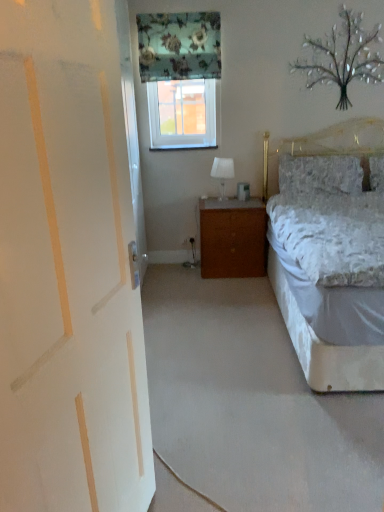
What do you see at coordinates (179, 46) in the screenshot? I see `floral fabric curtain at upper center` at bounding box center [179, 46].

Describe the element at coordinates (232, 238) in the screenshot. The height and width of the screenshot is (512, 384). I see `brown wood nightstand at center` at that location.

In order to face white glossy table lamp at center, should I rotate leftwards or rightwards?

It's best to rotate right around 3.916 degrees.

Describe the element at coordinates (343, 57) in the screenshot. I see `metallic silver tree at upper right` at that location.

The image size is (384, 512). Describe the element at coordinates (182, 114) in the screenshot. I see `clear glass window at upper center` at that location.

In order to face fluffy white pillow at right, should I rotate leftwards or rightwards?

A 16.675 degree turn to the right will do.

What do you see at coordinates (320, 174) in the screenshot? The width and height of the screenshot is (384, 512). I see `fluffy white pillow at right` at bounding box center [320, 174].

Identify the location of white painted wood door at left. (68, 268).

In order to click on floral fabric curtain at upper center in this screenshot , I will do `click(179, 46)`.

Is clear glass window at upper center oriented towards white glossy table lamp at center?

No, clear glass window at upper center does not turn towards white glossy table lamp at center.

Considering the relative sizes of clear glass window at upper center and white glossy table lamp at center in the image provided, is clear glass window at upper center taller than white glossy table lamp at center?

Yes, clear glass window at upper center is taller than white glossy table lamp at center.

Can we say brown wood nightstand at center lies outside white painted wood door at left?

Yes, brown wood nightstand at center is located beyond the bounds of white painted wood door at left.

Considering the sizes of objects brown wood nightstand at center and white painted wood door at left in the image provided, who is bigger, brown wood nightstand at center or white painted wood door at left?

white painted wood door at left is bigger.

Considering the sizes of brown wood nightstand at center and white painted wood door at left in the image, is brown wood nightstand at center taller or shorter than white painted wood door at left?

Considering their sizes, brown wood nightstand at center has less height than white painted wood door at left.

Which is behind, brown wood nightstand at center or white painted wood door at left?

brown wood nightstand at center is further away from the camera.

Can you tell me how much metallic silver tree at upper right and white glossy table lamp at center differ in facing direction?

0.569 degrees.

Is white glossy table lamp at center completely or partially inside metallic silver tree at upper right?

No, white glossy table lamp at center is not a part of metallic silver tree at upper right.

From a real-world perspective, is metallic silver tree at upper right positioned above or below white glossy table lamp at center?

metallic silver tree at upper right is situated higher than white glossy table lamp at center in the real world.

Does metallic silver tree at upper right have a greater height compared to white glossy table lamp at center?

Indeed, metallic silver tree at upper right has a greater height compared to white glossy table lamp at center.

How far apart are metallic silver tree at upper right and clear glass window at upper center?

A distance of 3.56 feet exists between metallic silver tree at upper right and clear glass window at upper center.

Does metallic silver tree at upper right turn towards clear glass window at upper center?

No, metallic silver tree at upper right is not oriented towards clear glass window at upper center.

Is metallic silver tree at upper right spatially inside clear glass window at upper center, or outside of it?

metallic silver tree at upper right is located beyond the bounds of clear glass window at upper center.

This screenshot has height=512, width=384. Identify the location of window on the left of metallic silver tree at upper right. (182, 114).

Is brown wood nightstand at center completely or partially inside clear glass window at upper center?

No, clear glass window at upper center does not contain brown wood nightstand at center.

Is clear glass window at upper center positioned before brown wood nightstand at center?

No, clear glass window at upper center is further to the viewer.

Can you confirm if clear glass window at upper center is bigger than brown wood nightstand at center?

No.

Consider the image. Is there a large distance between clear glass window at upper center and brown wood nightstand at center?

No, clear glass window at upper center is not far away from brown wood nightstand at center.

At what (x,y) coordinates should I click in order to perform the action: click on tree that is on the right side of floral fabric curtain at upper center. Please return your answer as a coordinate pair (x, y). The image size is (384, 512). Looking at the image, I should click on (343, 57).

Is metallic silver tree at upper right not within floral fabric curtain at upper center?

That's correct, metallic silver tree at upper right is outside of floral fabric curtain at upper center.

Is metallic silver tree at upper right in front of or behind floral fabric curtain at upper center in the image?

metallic silver tree at upper right is positioned farther from the viewer than floral fabric curtain at upper center.

Is white painted wood door at left positioned with its back to fluffy white pillow at right?

white painted wood door at left does not have its back to fluffy white pillow at right.

Which object is closer to the camera, white painted wood door at left or fluffy white pillow at right?

white painted wood door at left is closer to the camera.

Is white painted wood door at left next to fluffy white pillow at right and touching it?

No, white painted wood door at left is not beside fluffy white pillow at right.

Based on the photo, which of these two, white painted wood door at left or fluffy white pillow at right, is wider?

With larger width is fluffy white pillow at right.

I want to click on table lamp on the right of the clear glass window at upper center, so click(222, 172).

Locate an element on the screen. The image size is (384, 512). nightstand directly beneath the white painted wood door at left (from a real-world perspective) is located at coordinates (232, 238).

Which object lies nearer to the anchor point white glossy table lamp at center, fluffy white pillow at right or clear glass window at upper center?

clear glass window at upper center.

When comparing their distances from floral fabric curtain at upper center, does clear glass window at upper center or metallic silver tree at upper right seem closer?

Among the two, clear glass window at upper center is located nearer to floral fabric curtain at upper center.

Estimate the real-world distances between objects in this image. Which object is closer to clear glass window at upper center, white painted wood door at left or brown wood nightstand at center?

brown wood nightstand at center lies closer to clear glass window at upper center than the other object.

Considering their positions, is fluffy white pillow at right positioned closer to brown wood nightstand at center than metallic silver tree at upper right?

Based on the image, fluffy white pillow at right appears to be nearer to brown wood nightstand at center.

Considering their positions, is fluffy white pillow at right positioned closer to white glossy table lamp at center than white painted wood door at left?

Among the two, fluffy white pillow at right is located nearer to white glossy table lamp at center.

Looking at the image, which one is located further to brown wood nightstand at center, clear glass window at upper center or fluffy white pillow at right?

clear glass window at upper center.

Based on the photo, looking at the image, which one is located closer to white glossy table lamp at center, clear glass window at upper center or fluffy white pillow at right?

Based on the image, clear glass window at upper center appears to be nearer to white glossy table lamp at center.

When comparing their distances from floral fabric curtain at upper center, does brown wood nightstand at center or white painted wood door at left seem further?

white painted wood door at left is positioned further to the anchor floral fabric curtain at upper center.

Locate an element on the screen. This screenshot has width=384, height=512. nightstand between white glossy table lamp at center and fluffy white pillow at right in the horizontal direction is located at coordinates pyautogui.click(x=232, y=238).

The image size is (384, 512). Identify the location of curtain located between white painted wood door at left and white glossy table lamp at center in the depth direction. (179, 46).

Where is `pillow between white painted wood door at left and white glossy table lamp at center in the front-back direction`? This screenshot has height=512, width=384. pillow between white painted wood door at left and white glossy table lamp at center in the front-back direction is located at coordinates (320, 174).

Locate an element on the screen. This screenshot has width=384, height=512. nightstand between white painted wood door at left and fluffy white pillow at right from front to back is located at coordinates (232, 238).